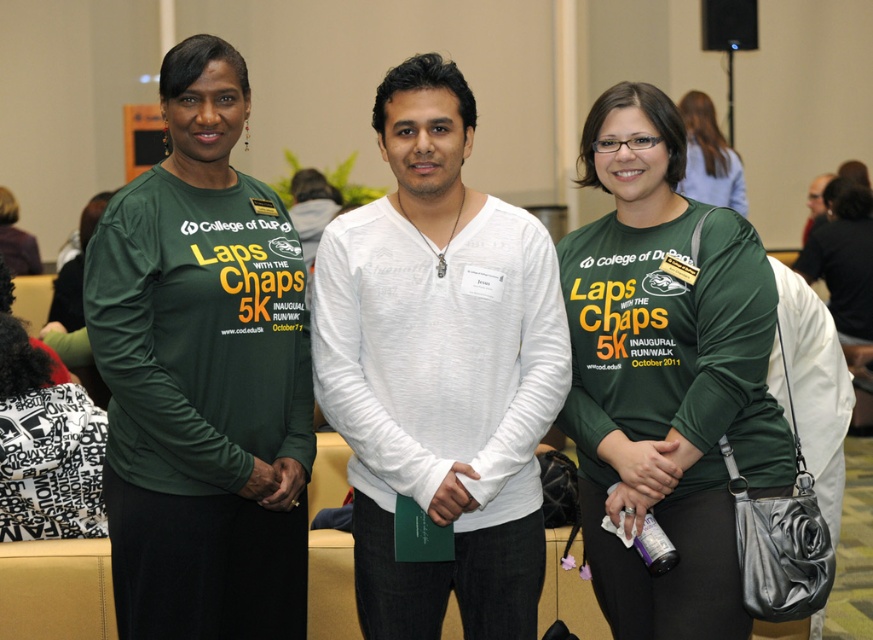
What is the position of the point with coordinates (438, 371) in the image?

The point with coordinates (438, 371) is located on the white soft shirt at center.

Based on the scene description, what object is located at the coordinates point (709,157)?

The point (709,157) corresponds to the matte green shirt at center.